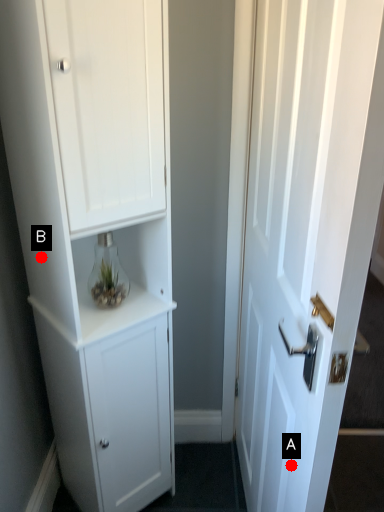
Question: Two points are circled on the image, labeled by A and B beside each circle. Among these points, which one is nearest to the camera?

Choices:
 (A) A is closer
 (B) B is closer

Answer: (A)